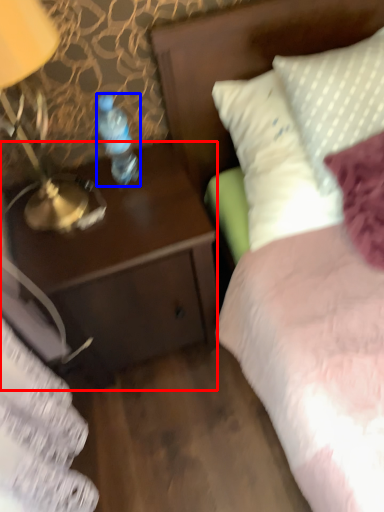
Question: Among these objects, which one is nearest to the camera, desk (highlighted by a red box) or bottle (highlighted by a blue box)?

Choices:
 (A) desk
 (B) bottle

Answer: (B)